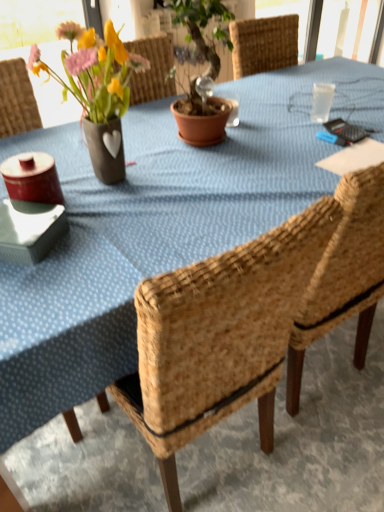
Where is `free spot below matte ceramic vase at upper left (from a real-world perspective)`? Image resolution: width=384 pixels, height=512 pixels. free spot below matte ceramic vase at upper left (from a real-world perspective) is located at coordinates (110, 186).